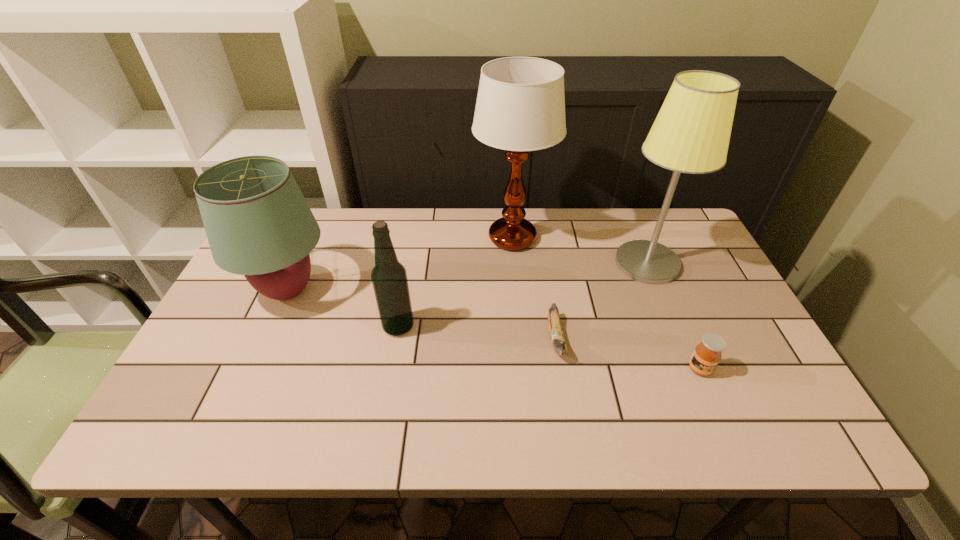
In order to click on the right table lamp in this screenshot , I will do `click(691, 133)`.

Where is `the left table lamp`? The height and width of the screenshot is (540, 960). the left table lamp is located at coordinates [520, 107].

Locate an element on the screen. Image resolution: width=960 pixels, height=540 pixels. the leftmost object is located at coordinates (258, 224).

Identify the location of alcohol. (389, 278).

Find the location of a particular element. The image size is (960, 540). honey is located at coordinates (707, 354).

This screenshot has width=960, height=540. Identify the location of banana. (557, 338).

Image resolution: width=960 pixels, height=540 pixels. In order to click on vacant space located on the front of the right table lamp in this screenshot , I will do click(x=678, y=338).

Image resolution: width=960 pixels, height=540 pixels. Identify the location of vacant region located on the left of the left table lamp. (402, 238).

At what (x,y) coordinates should I click in order to perform the action: click on vacant space located on the back of the lampshade. Please return your answer as a coordinate pair (x, y). This screenshot has width=960, height=540. Looking at the image, I should click on (324, 212).

Locate an element on the screen. vacant point located on the right of the fifth object from right to left is located at coordinates [562, 327].